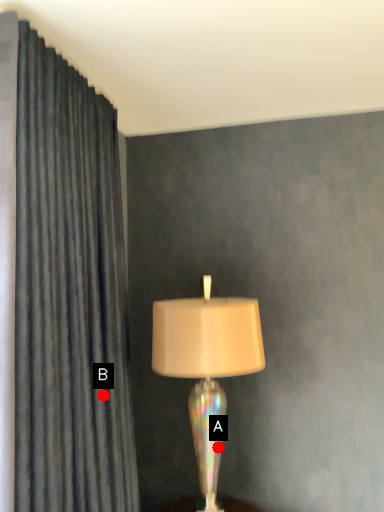
Question: Two points are circled on the image, labeled by A and B beside each circle. Which point appears farthest from the camera in this image?

Choices:
 (A) A is further
 (B) B is further

Answer: (A)